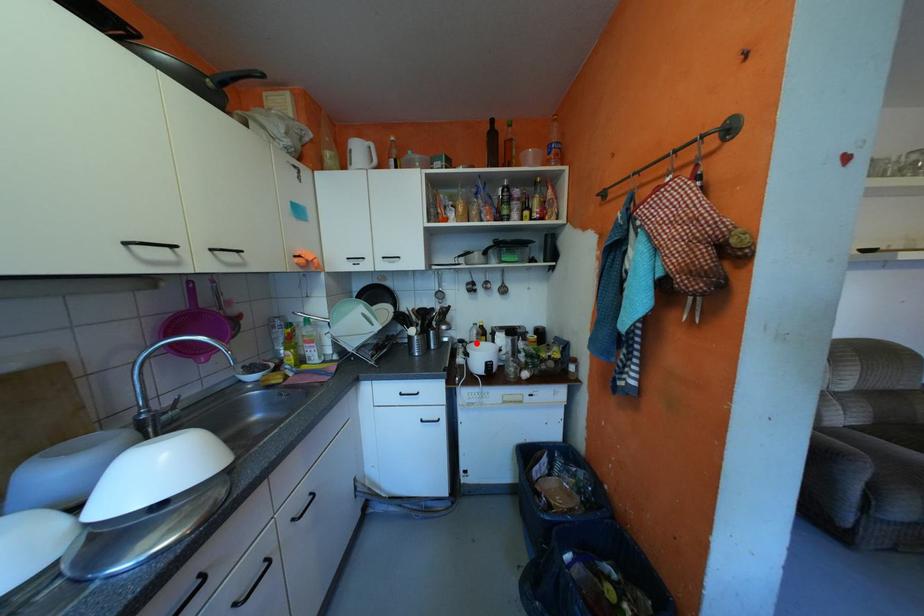
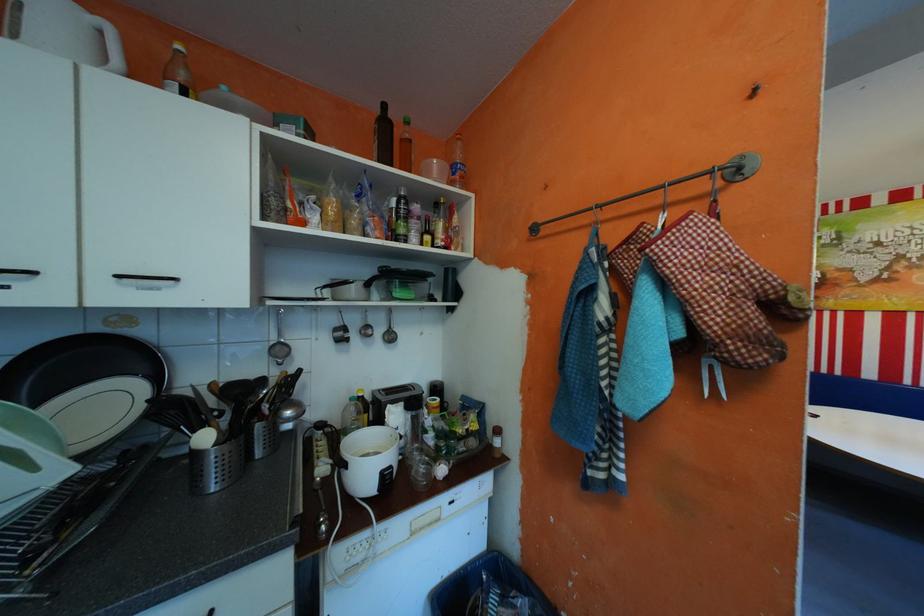
In the second image, find the point that corresponds to the highlighted location in the first image.

(339, 429)